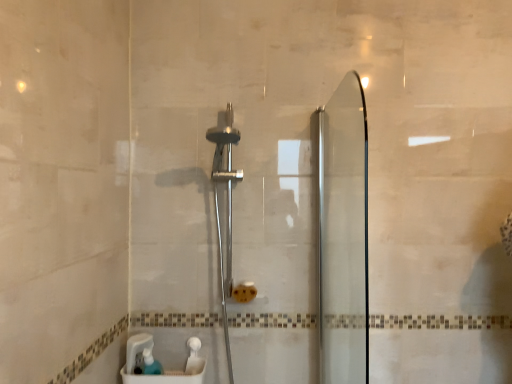
Question: Considering the relative sizes of translucent plastic soap dispenser at lower left and translucent plastic container at lower center in the image provided, is translucent plastic soap dispenser at lower left wider than translucent plastic container at lower center?

Choices:
 (A) no
 (B) yes

Answer: (A)

Question: Does translucent plastic soap dispenser at lower left have a greater height compared to translucent plastic container at lower center?

Choices:
 (A) yes
 (B) no

Answer: (B)

Question: Are translucent plastic soap dispenser at lower left and translucent plastic container at lower center making contact?

Choices:
 (A) no
 (B) yes

Answer: (B)

Question: Is translucent plastic soap dispenser at lower left to the right of translucent plastic container at lower center from the viewer's perspective?

Choices:
 (A) yes
 (B) no

Answer: (B)

Question: From the image's perspective, is translucent plastic soap dispenser at lower left above translucent plastic container at lower center?

Choices:
 (A) yes
 (B) no

Answer: (A)

Question: Is transparent glass screen door at right to the left or to the right of polished chrome shower head at center in the image?

Choices:
 (A) left
 (B) right

Answer: (B)

Question: In terms of size, does transparent glass screen door at right appear bigger or smaller than polished chrome shower head at center?

Choices:
 (A) small
 (B) big

Answer: (A)

Question: Is transparent glass screen door at right situated inside polished chrome shower head at center or outside?

Choices:
 (A) outside
 (B) inside

Answer: (A)

Question: From their relative heights in the image, would you say transparent glass screen door at right is taller or shorter than polished chrome shower head at center?

Choices:
 (A) tall
 (B) short

Answer: (B)

Question: Would you say translucent plastic soap dispenser at lower left is to the left or to the right of polished chrome shower head at center in the picture?

Choices:
 (A) left
 (B) right

Answer: (A)

Question: Is point (145, 355) positioned closer to the camera than point (227, 240)?

Choices:
 (A) closer
 (B) farther

Answer: (A)

Question: Considering the positions of translucent plastic soap dispenser at lower left and polished chrome shower head at center in the image, is translucent plastic soap dispenser at lower left taller or shorter than polished chrome shower head at center?

Choices:
 (A) tall
 (B) short

Answer: (B)

Question: From a real-world perspective, is translucent plastic soap dispenser at lower left physically located above or below polished chrome shower head at center?

Choices:
 (A) below
 (B) above

Answer: (A)

Question: Is point (228, 170) closer or farther from the camera than point (346, 367)?

Choices:
 (A) farther
 (B) closer

Answer: (A)

Question: Based on their positions, is polished chrome shower head at center located to the left or right of transparent glass screen door at right?

Choices:
 (A) right
 (B) left

Answer: (B)